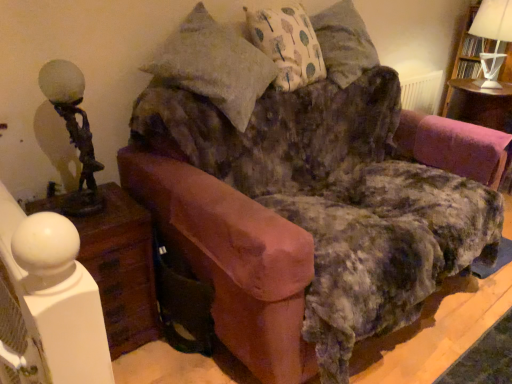
Question: Looking at the image, does white wood nightstand at lower left seem bigger or smaller compared to white paper lampshade at upper right?

Choices:
 (A) big
 (B) small

Answer: (A)

Question: From the image's perspective, relative to white paper lampshade at upper right, is white wood nightstand at lower left above or below?

Choices:
 (A) below
 (B) above

Answer: (A)

Question: Which object is the farthest from the white paper lampshade at upper right?

Choices:
 (A) white fabric pillow with tree pattern at upper center
 (B) white fabric lampshade at upper right, the 2th table lamp when ordered from bottom to top
 (C) velvet pink swivel chair at right
 (D) white wood nightstand at lower left
 (E) bronze/golden statue-like at left, acting as the 1th table lamp starting from the bottom

Answer: (E)

Question: Estimate the real-world distances between objects in this image. Which object is closer to the white paper lampshade at upper right?

Choices:
 (A) velvet pink swivel chair at right
 (B) white wood nightstand at lower left
 (C) white fabric pillow with tree pattern at upper center
 (D) bronze/golden statue-like at left, arranged as the 2th table lamp when viewed from the right
 (E) white fabric lampshade at upper right, positioned as the 1th table lamp in right-to-left order

Answer: (E)